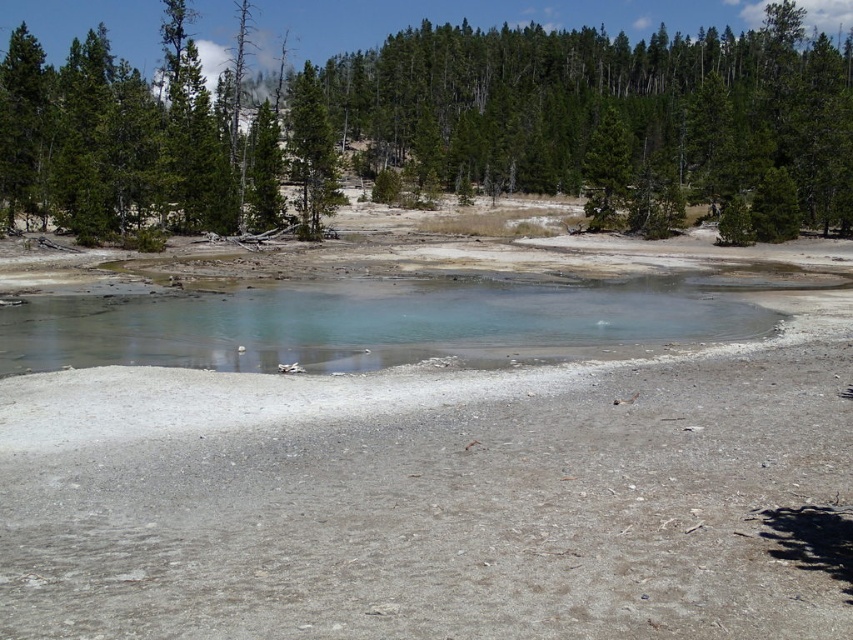
In the scene shown: You are standing at the edge of the geothermal pool and see two points marked in the image. Which point, point (x=688, y=140) or point (x=260, y=362), is closer to you?

Point (x=260, y=362) is closer to you because it is less further to the camera than point (x=688, y=140).